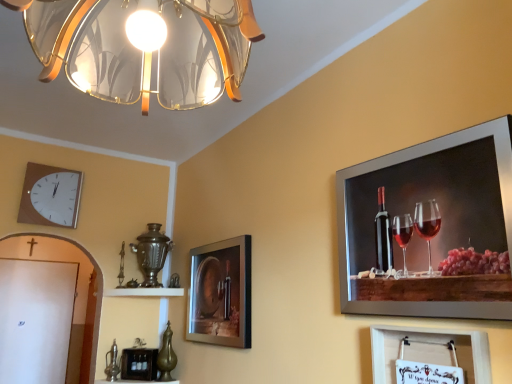
Question: Is translucent glass lampshade at upper center turned away from matte glass picture frame at center, arranged as the second picture frame when viewed from the left?

Choices:
 (A) no
 (B) yes

Answer: (A)

Question: Is translucent glass lampshade at upper center aimed at matte glass picture frame at center, arranged as the second picture frame when viewed from the left?

Choices:
 (A) no
 (B) yes

Answer: (A)

Question: From a real-world perspective, is translucent glass lampshade at upper center under matte glass picture frame at center, arranged as the 2th picture frame when viewed from the back?

Choices:
 (A) no
 (B) yes

Answer: (A)

Question: Can you confirm if translucent glass lampshade at upper center is shorter than matte glass picture frame at center, arranged as the 2th picture frame when viewed from the back?

Choices:
 (A) no
 (B) yes

Answer: (B)

Question: Is translucent glass lampshade at upper center bigger than matte glass picture frame at center, arranged as the second picture frame when viewed from the left?

Choices:
 (A) no
 (B) yes

Answer: (B)

Question: From a real-world perspective, is translucent glass lampshade at upper center positioned above or below wooden picture frame at lower center, the 4th picture frame in the right-to-left sequence?

Choices:
 (A) below
 (B) above

Answer: (B)

Question: Does point (47, 16) appear closer or farther from the camera than point (138, 377)?

Choices:
 (A) closer
 (B) farther

Answer: (A)

Question: Considering the positions of translucent glass lampshade at upper center and wooden picture frame at lower center, the fourth picture frame when ordered from front to back, in the image, is translucent glass lampshade at upper center wider or thinner than wooden picture frame at lower center, the fourth picture frame when ordered from front to back,?

Choices:
 (A) wide
 (B) thin

Answer: (A)

Question: Looking at the image, does translucent glass lampshade at upper center seem bigger or smaller compared to wooden picture frame at lower center, the fourth picture frame when ordered from front to back?

Choices:
 (A) small
 (B) big

Answer: (B)

Question: From their relative heights in the image, would you say translucent glass lampshade at upper center is taller or shorter than white glossy shelf at center?

Choices:
 (A) short
 (B) tall

Answer: (B)

Question: Considering the positions of translucent glass lampshade at upper center and white glossy shelf at center in the image, is translucent glass lampshade at upper center bigger or smaller than white glossy shelf at center?

Choices:
 (A) small
 (B) big

Answer: (B)

Question: From a real-world perspective, is translucent glass lampshade at upper center physically located above or below white glossy shelf at center?

Choices:
 (A) above
 (B) below

Answer: (A)

Question: Looking at their shapes, would you say translucent glass lampshade at upper center is wider or thinner than white glossy shelf at center?

Choices:
 (A) wide
 (B) thin

Answer: (A)

Question: From a real-world perspective, is white glossy shelf at center positioned above or below metallic silver picture frame at upper right, which ranks as the second picture frame in right-to-left order?

Choices:
 (A) below
 (B) above

Answer: (A)

Question: Looking at their shapes, would you say white glossy shelf at center is wider or thinner than metallic silver picture frame at upper right, marked as the first picture frame in a front-to-back arrangement?

Choices:
 (A) wide
 (B) thin

Answer: (A)